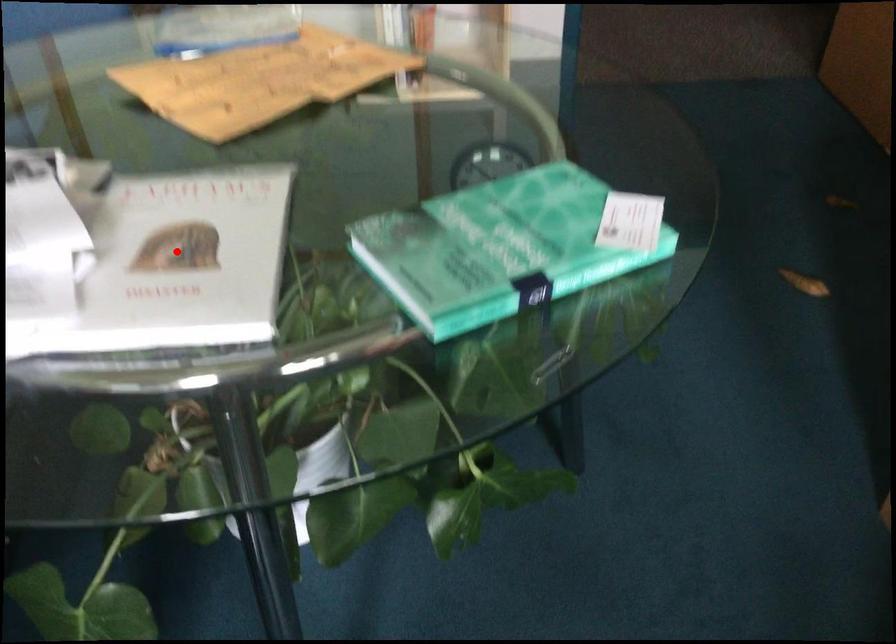
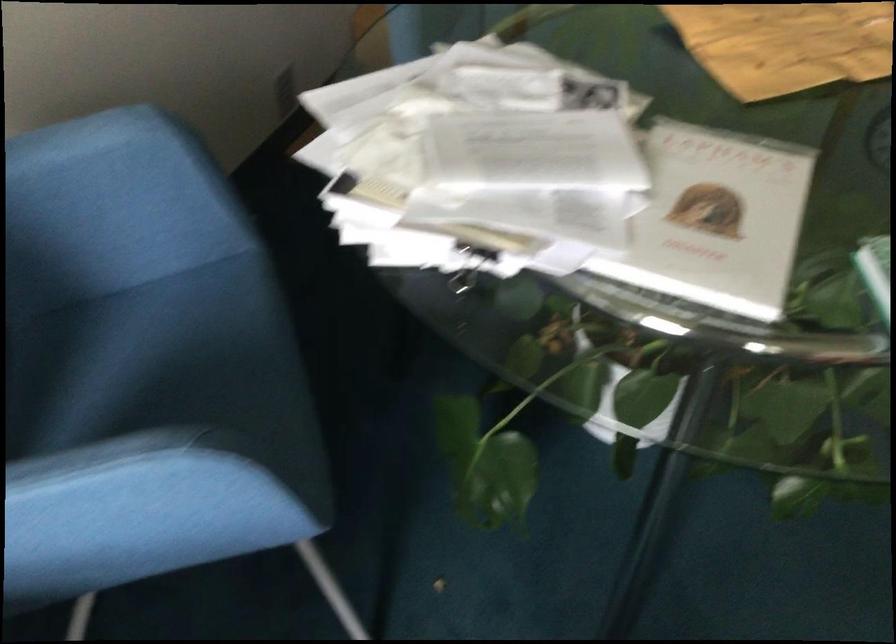
Question: I am providing you with two images of the same scene from different viewpoints. Given a red point in image1, look at the same physical point in image2. Is it:

Choices:
 (A) Closer to the viewpoint
 (B) Farther from the viewpoint

Answer: (B)